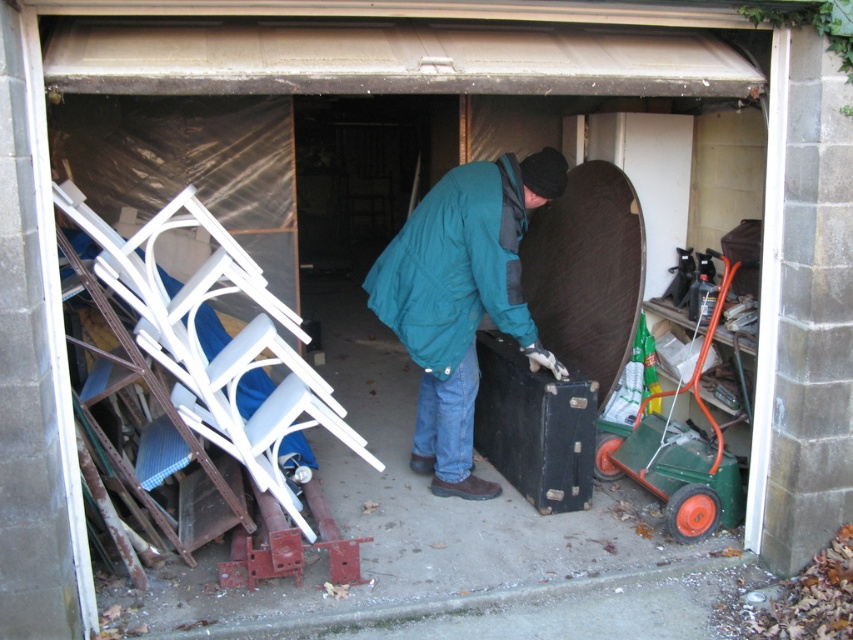
Question: Which point is closer to the camera?

Choices:
 (A) (465, 308)
 (B) (664, 428)

Answer: (A)

Question: Is teal fabric jacket at center thinner than green plastic cart at right?

Choices:
 (A) yes
 (B) no

Answer: (B)

Question: Considering the relative positions of teal fabric jacket at center and green plastic cart at right in the image provided, where is teal fabric jacket at center located with respect to green plastic cart at right?

Choices:
 (A) above
 (B) below

Answer: (A)

Question: Is teal fabric jacket at center thinner than green plastic cart at right?

Choices:
 (A) yes
 (B) no

Answer: (B)